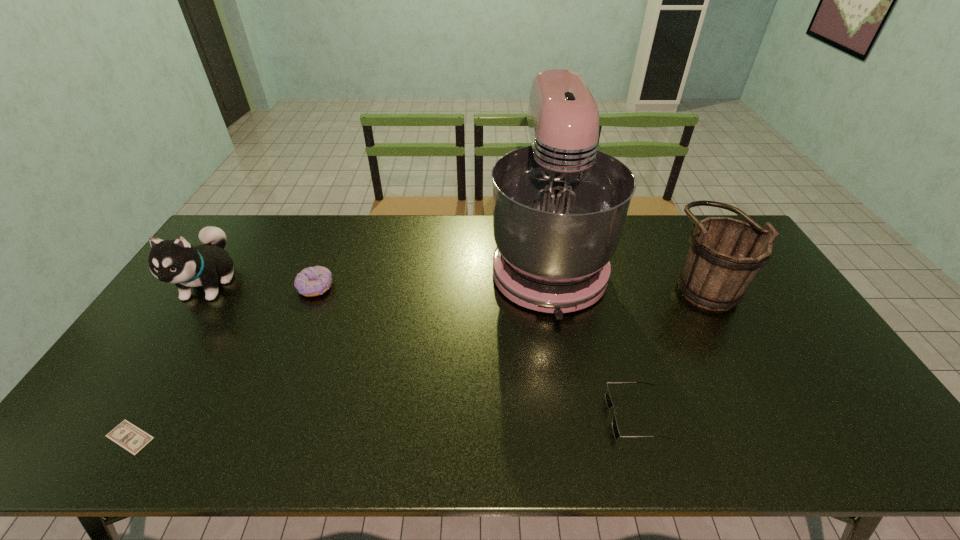
You are a GUI agent. You are given a task and a screenshot of the screen. Output one action in this format:
    pyautogui.click(x=<x>, y=<y>)
    Task: Click on the vacant space located on the handle side of the bucket
    This screenshot has width=960, height=540.
    Given the screenshot: What is the action you would take?
    pyautogui.click(x=568, y=280)

The height and width of the screenshot is (540, 960). Find the location of `vacant area located 0.080m at the face of the puppy`. vacant area located 0.080m at the face of the puppy is located at coordinates click(x=172, y=339).

You are a GUI agent. You are given a task and a screenshot of the screen. Output one action in this format:
    pyautogui.click(x=<x>, y=<y>)
    Task: Click on the free space located on the right of the third object from left to right
    Image resolution: width=960 pixels, height=540 pixels.
    Given the screenshot: What is the action you would take?
    pyautogui.click(x=362, y=287)

Image resolution: width=960 pixels, height=540 pixels. What are the coordinates of `blank space located 0.250m on the front-facing side of the sunglasses` in the screenshot? It's located at (506, 416).

The height and width of the screenshot is (540, 960). Identify the location of vacant region located on the front-facing side of the sunglasses. (460, 416).

I want to click on vacant region located on the front-facing side of the sunglasses, so click(x=556, y=416).

You are a GUI agent. You are given a task and a screenshot of the screen. Output one action in this format:
    pyautogui.click(x=<x>, y=<y>)
    Task: Click on the vacant position located 0.370m on the right of the shortest object
    
    Given the screenshot: What is the action you would take?
    pyautogui.click(x=314, y=437)

Image resolution: width=960 pixels, height=540 pixels. I want to click on mixer located at the far edge, so click(x=559, y=206).

The width and height of the screenshot is (960, 540). I want to click on bucket present at the far edge, so click(x=725, y=255).

Where is `puppy present at the far edge`? Image resolution: width=960 pixels, height=540 pixels. puppy present at the far edge is located at coordinates (177, 262).